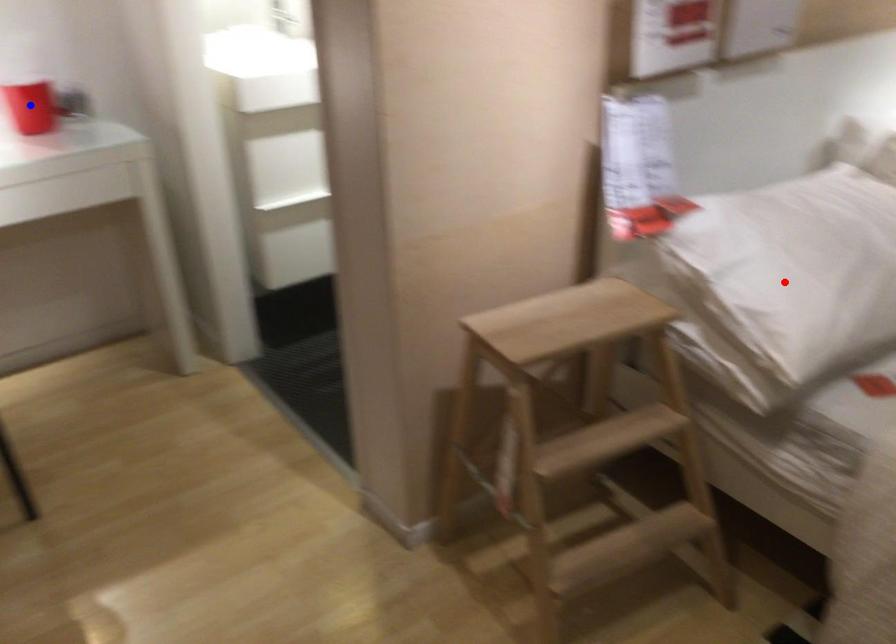
Question: Which of the two points in the image is closer to the camera?

Choices:
 (A) Blue point is closer.
 (B) Red point is closer.

Answer: (B)